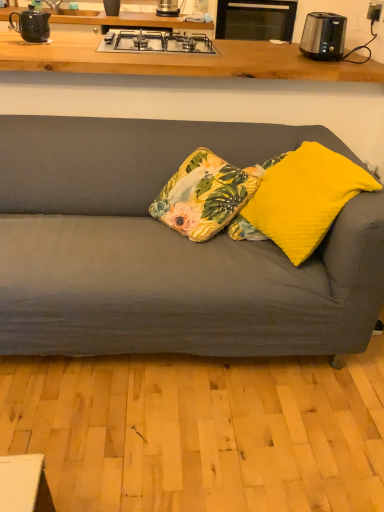
The width and height of the screenshot is (384, 512). In order to click on vacant area in front of matte black teapot at upper left in this screenshot , I will do `click(29, 42)`.